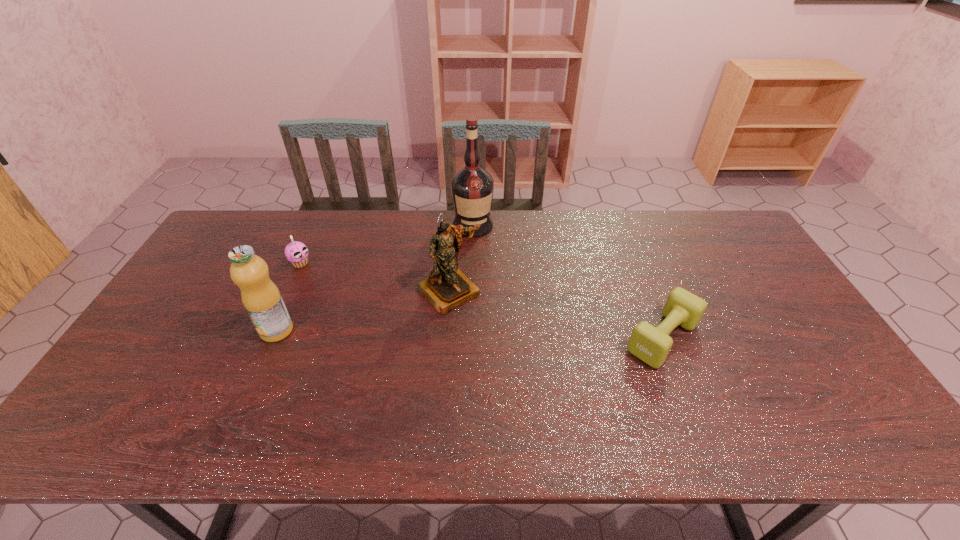
This screenshot has height=540, width=960. In order to click on vacant area in the image that satisfies the following two spatial constraints: 1. on the back side of the figurine; 2. on the right side of the farthest object in this screenshot , I will do `click(454, 225)`.

Where is `free space that satisfies the following two spatial constraints: 1. on the front label of the shortest object; 2. on the left side of the fruit juice`? This screenshot has width=960, height=540. free space that satisfies the following two spatial constraints: 1. on the front label of the shortest object; 2. on the left side of the fruit juice is located at coordinates (274, 338).